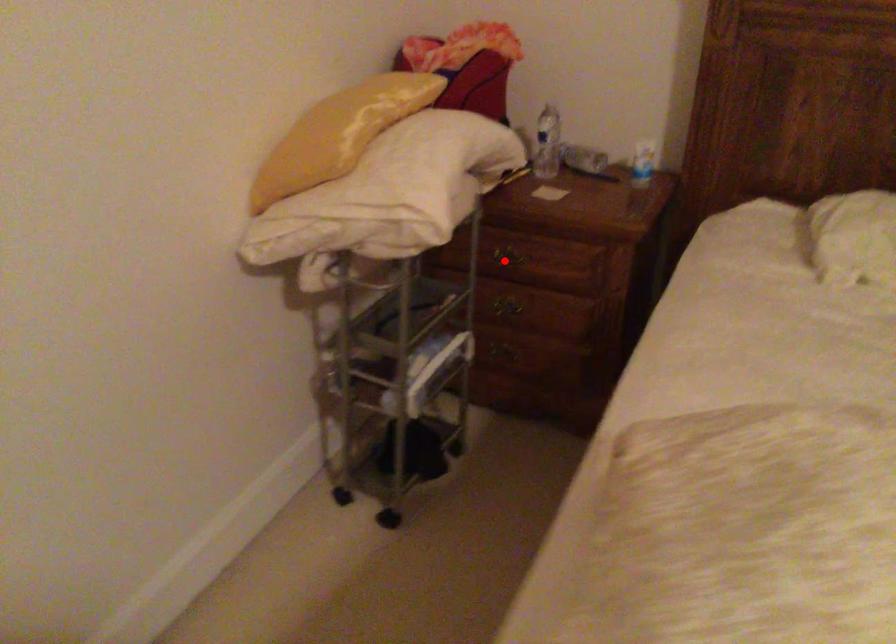
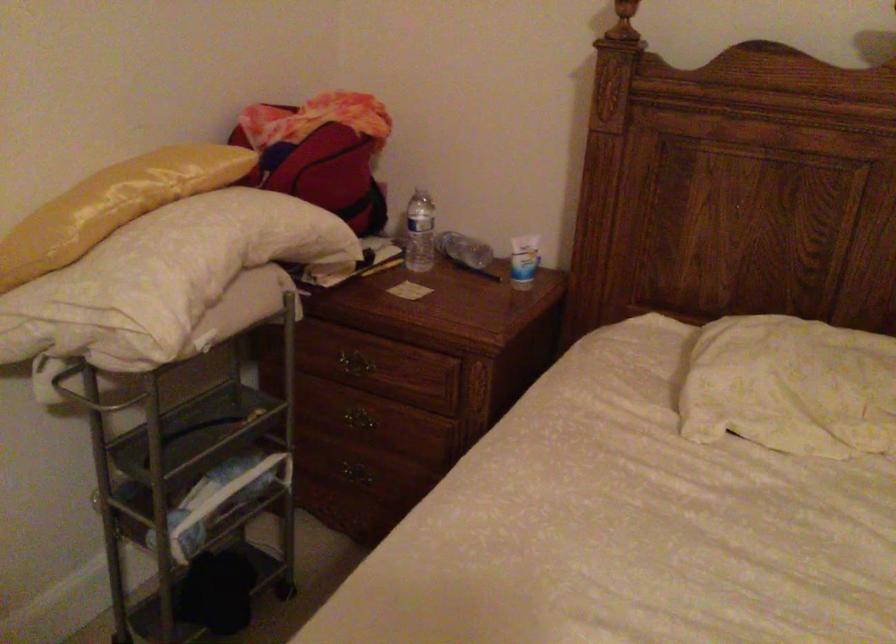
Question: I am providing you with two images of the same scene from different viewpoints. In image1, a red point is highlighted. Considering the same 3D point in image2, which of the following is correct?

Choices:
 (A) It is closer
 (B) It is farther

Answer: (A)